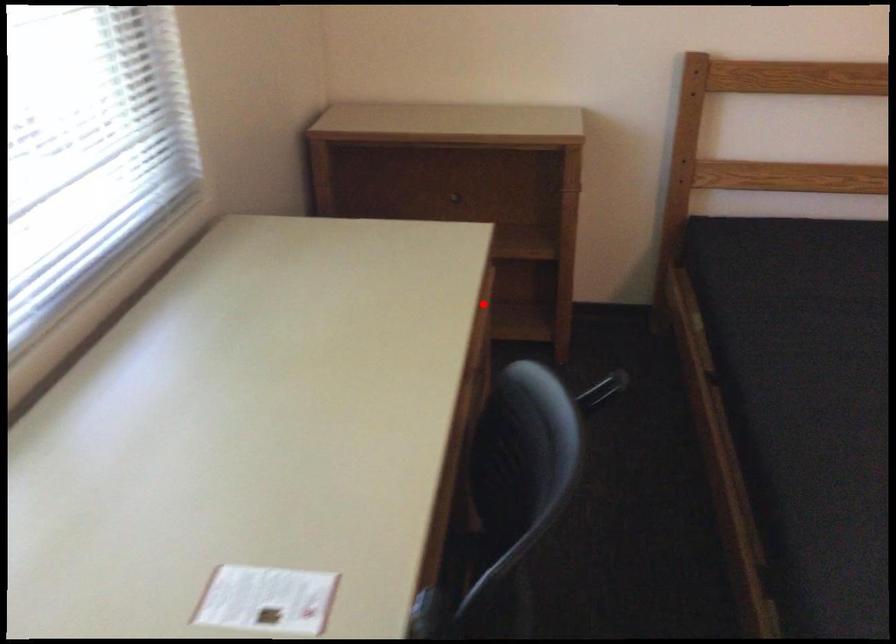
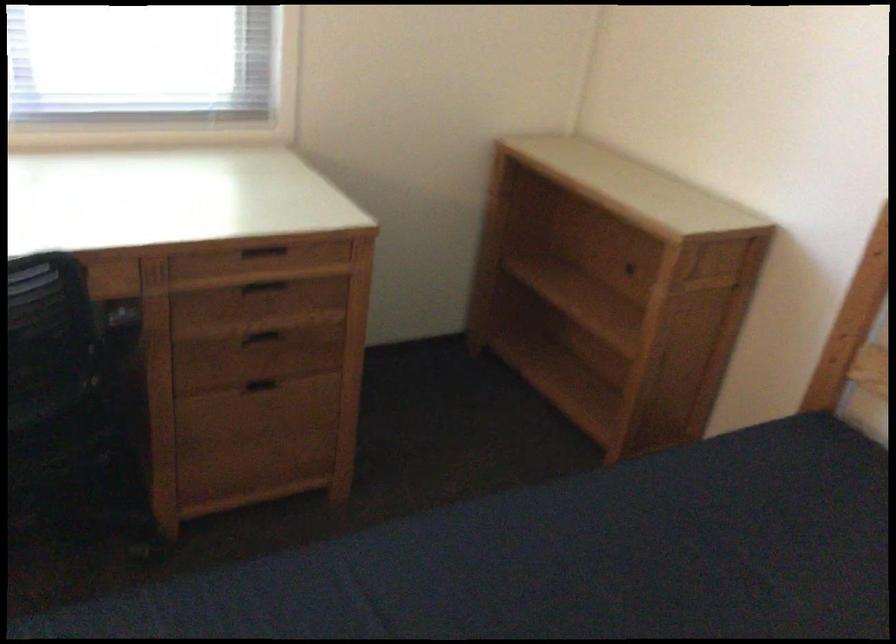
In the second image, find the point that corresponds to the highlighted location in the first image.

(263, 252)